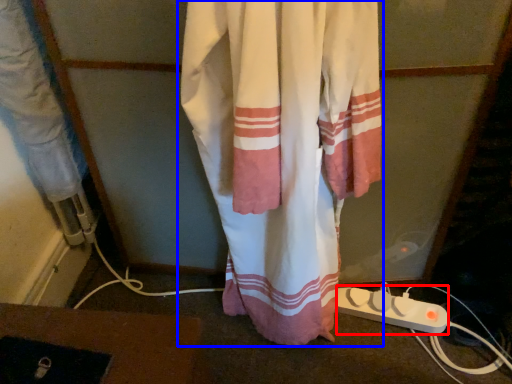
Question: Which point is closer to the camera, extension cord (highlighted by a red box) or curtain (highlighted by a blue box)?

Choices:
 (A) extension cord
 (B) curtain

Answer: (B)